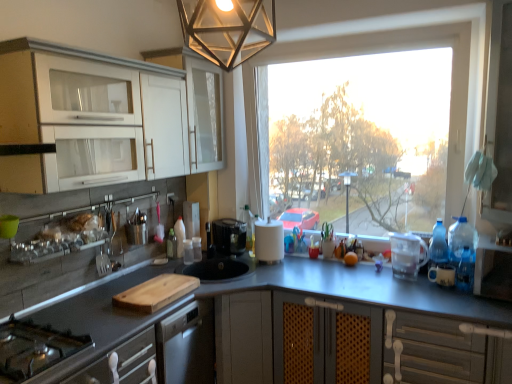
At what (x,y) coordinates should I click in order to perform the action: click on free space to the left of blue translucent bottle at right, which appears as the 4th bottle when viewed from the back. Please return your answer as a coordinate pair (x, y). Looking at the image, I should click on (431, 295).